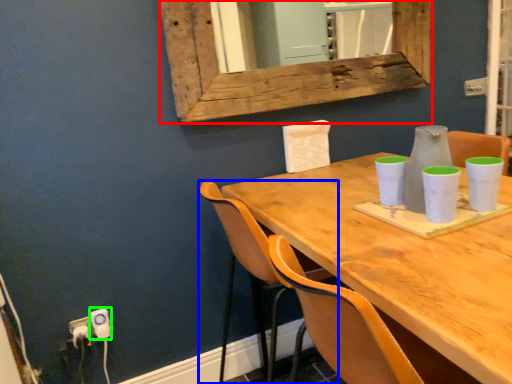
Question: Which object is positioned closest to window frame (highlighted by a red box)? Select from chair (highlighted by a blue box) and electric outlet (highlighted by a green box).

Choices:
 (A) chair
 (B) electric outlet

Answer: (A)